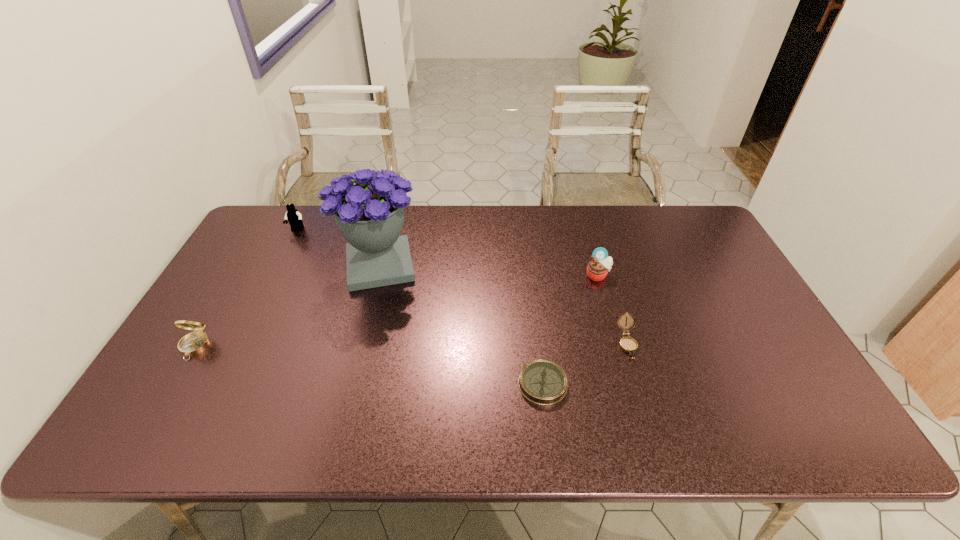
Where is `compass that stands as the second closest to the second shortest object`? compass that stands as the second closest to the second shortest object is located at coordinates (194, 343).

Image resolution: width=960 pixels, height=540 pixels. Find the location of `free space that satisfies the following two spatial constraints: 1. with the dial facing the nearest compass; 2. on the left side of the leftmost object`. free space that satisfies the following two spatial constraints: 1. with the dial facing the nearest compass; 2. on the left side of the leftmost object is located at coordinates (173, 384).

Locate an element on the screen. This screenshot has height=540, width=960. free spot that satisfies the following two spatial constraints: 1. on the front-facing side of the third object from left to right; 2. on the right side of the Lego is located at coordinates (279, 266).

The image size is (960, 540). I want to click on vacant area that satisfies the following two spatial constraints: 1. on the front-facing side of the second compass from right to left; 2. on the right side of the farthest object, so click(x=220, y=384).

I want to click on free spot that satisfies the following two spatial constraints: 1. on the front-facing side of the fifth object from right to left; 2. on the right side of the fourth object from right to left, so click(279, 266).